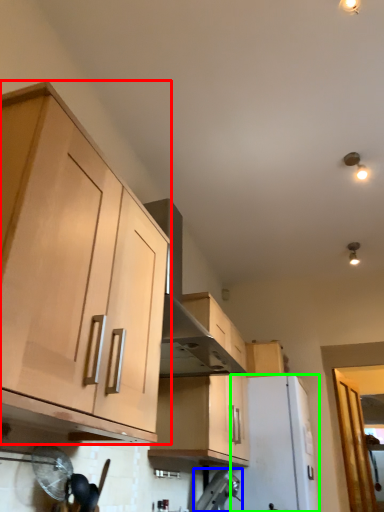
Question: Based on their relative distances, which object is nearer to cabinetry (highlighted by a red box)? Choose from appliance (highlighted by a blue box) and appliance (highlighted by a green box).

Choices:
 (A) appliance
 (B) appliance

Answer: (A)